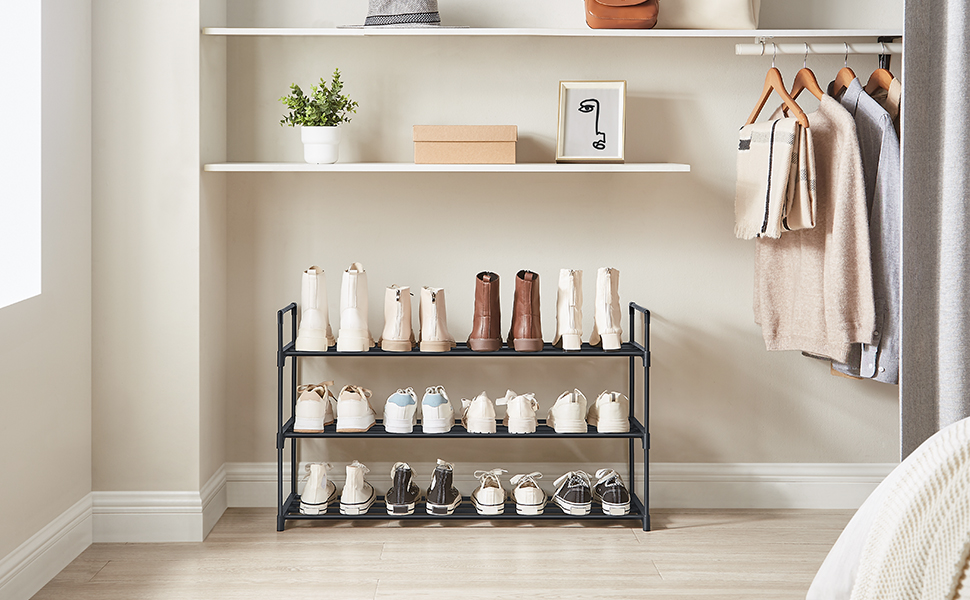
Where is `storage shelves`? The width and height of the screenshot is (970, 600). storage shelves is located at coordinates (629, 512), (630, 432), (624, 350), (624, 157), (637, 30).